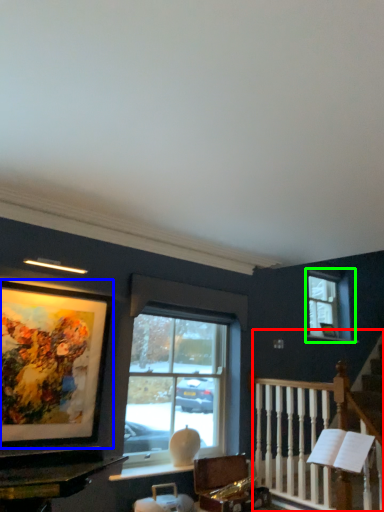
Question: Which is farther away from rail (highlighted by a red box)? picture frame (highlighted by a blue box) or window (highlighted by a green box)?

Choices:
 (A) picture frame
 (B) window

Answer: (A)